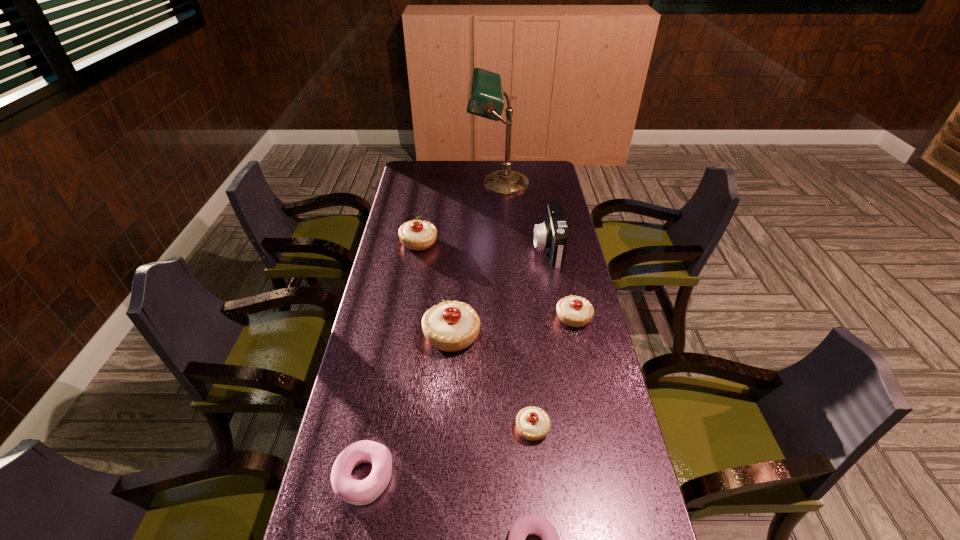
What are the coordinates of `free region located 0.220m on the front of the fifth tallest object` in the screenshot? It's located at (588, 390).

Locate an element on the screen. free region located 0.200m on the right of the smallest beige pastry is located at coordinates (625, 428).

I want to click on blank space located 0.350m on the right of the left pink pastry, so click(x=538, y=476).

The height and width of the screenshot is (540, 960). What are the coordinates of `object that is positioned at the far edge` in the screenshot? It's located at (485, 97).

The height and width of the screenshot is (540, 960). Find the location of `table lamp that is positioned at the right edge`. table lamp that is positioned at the right edge is located at coordinates (485, 97).

The width and height of the screenshot is (960, 540). In order to click on camcorder that is at the right edge in this screenshot , I will do `click(552, 235)`.

Where is `pastry that is at the right edge`? The width and height of the screenshot is (960, 540). pastry that is at the right edge is located at coordinates (573, 311).

The height and width of the screenshot is (540, 960). Identify the location of object that is at the far right corner. (485, 97).

Identify the location of vacant space at the far edge. (446, 161).

In the image, there is a desktop. What are the coordinates of `vacant space at the left edge` in the screenshot? It's located at (392, 429).